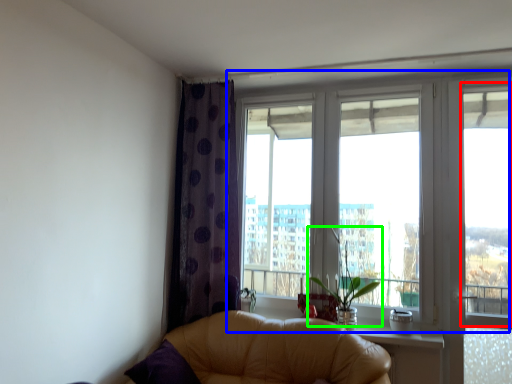
Question: Which object is positioned closest to window screen (highlighted by a red box)? Select from window (highlighted by a blue box) and plant (highlighted by a green box).

Choices:
 (A) window
 (B) plant

Answer: (A)